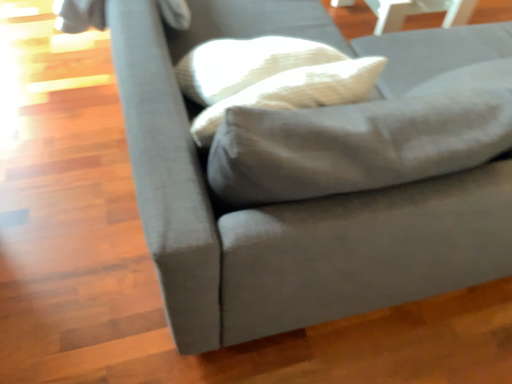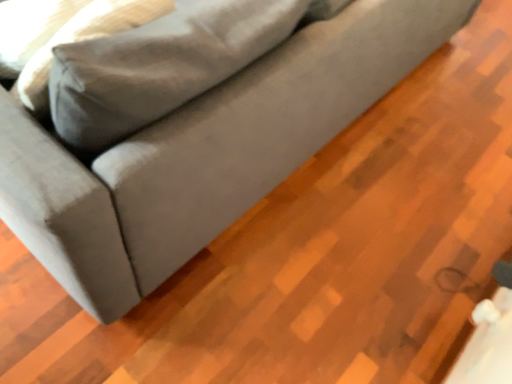
Question: How did the camera likely rotate when shooting the video?

Choices:
 (A) rotated left
 (B) rotated right

Answer: (B)